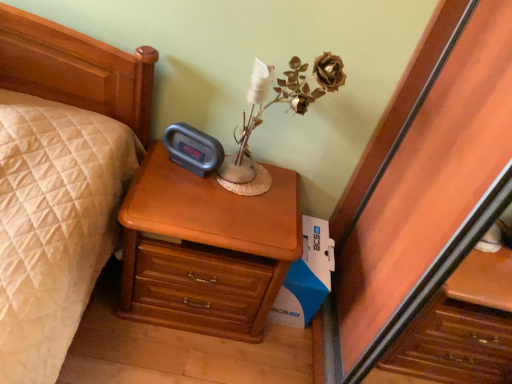
Describe the element at coordinates (206, 250) in the screenshot. This screenshot has width=512, height=384. I see `light brown wood nightstand at center` at that location.

This screenshot has height=384, width=512. What do you see at coordinates (329, 72) in the screenshot?
I see `brown dried flower at upper right` at bounding box center [329, 72].

Identify the location of light brown wood nightstand at center. The height and width of the screenshot is (384, 512). (206, 250).

Could you tell me if light brown wood nightstand at center is turned towards brown dried flower at upper right?

No, light brown wood nightstand at center is not turned towards brown dried flower at upper right.

Which object is thinner, light brown wood nightstand at center or brown dried flower at upper right?

brown dried flower at upper right.

Considering the sizes of objects light brown wood nightstand at center and brown dried flower at upper right in the image provided, who is taller, light brown wood nightstand at center or brown dried flower at upper right?

Standing taller between the two is light brown wood nightstand at center.

In the scene shown: Is light brown wood nightstand at center positioned before brown dried flower at upper right?

That is True.

Relative to light brown wood nightstand at center, is white cardboard box at lower right in front or behind?

In the image, white cardboard box at lower right appears behind light brown wood nightstand at center.

Is white cardboard box at lower right not close to light brown wood nightstand at center?

They are positioned close to each other.

Considering the relative positions of white cardboard box at lower right and light brown wood nightstand at center in the image provided, is white cardboard box at lower right to the left of light brown wood nightstand at center from the viewer's perspective?

No, white cardboard box at lower right is not to the left of light brown wood nightstand at center.

The height and width of the screenshot is (384, 512). In the image, there is a white cardboard box at lower right. What are the coordinates of `nightstand above it (from the image's perspective)` in the screenshot? It's located at (206, 250).

The width and height of the screenshot is (512, 384). Find the location of `flower to the right of light brown wood nightstand at center`. flower to the right of light brown wood nightstand at center is located at coordinates (329, 72).

Is brown dried flower at upper right outside of light brown wood nightstand at center?

brown dried flower at upper right is positioned outside light brown wood nightstand at center.

What's the angular difference between brown dried flower at upper right and light brown wood nightstand at center's facing directions?

The angular difference between brown dried flower at upper right and light brown wood nightstand at center is 0.431 degrees.

Is brown dried flower at upper right with light brown wood nightstand at center?

They are not placed beside each other.

Do you think brown dried flower at upper right is within white cardboard box at lower right, or outside of it?

brown dried flower at upper right is not inside white cardboard box at lower right, it's outside.

Considering the sizes of brown dried flower at upper right and white cardboard box at lower right in the image, is brown dried flower at upper right wider or thinner than white cardboard box at lower right?

Considering their sizes, brown dried flower at upper right looks slimmer than white cardboard box at lower right.

From a real-world perspective, is brown dried flower at upper right located higher than white cardboard box at lower right?

Indeed, from a real-world perspective, brown dried flower at upper right stands above white cardboard box at lower right.

Which is more to the left, white cardboard box at lower right or brown dried flower at upper right?

From the viewer's perspective, white cardboard box at lower right appears more on the left side.

What's the angular difference between white cardboard box at lower right and brown dried flower at upper right's facing directions?

The facing directions of white cardboard box at lower right and brown dried flower at upper right are 0.43 degrees apart.

Looking at this image, is brown dried flower at upper right surrounded by white cardboard box at lower right?

Definitely not — brown dried flower at upper right is not inside white cardboard box at lower right.

Considering the relative positions of white cardboard box at lower right and brown dried flower at upper right in the image provided, is white cardboard box at lower right in front of brown dried flower at upper right?

No, white cardboard box at lower right is further to the viewer.

From a real-world perspective, who is located higher, light brown wood nightstand at center or white cardboard box at lower right?

light brown wood nightstand at center is physically above.

Is light brown wood nightstand at center positioned far away from white cardboard box at lower right?

light brown wood nightstand at center is near white cardboard box at lower right, not far away.

In the scene shown: Who is taller, light brown wood nightstand at center or white cardboard box at lower right?

With more height is light brown wood nightstand at center.

Does light brown wood nightstand at center have a larger size compared to white cardboard box at lower right?

Correct, light brown wood nightstand at center is larger in size than white cardboard box at lower right.

This screenshot has width=512, height=384. Find the location of `nightstand on the left of the brown dried flower at upper right`. nightstand on the left of the brown dried flower at upper right is located at coordinates (206, 250).

The height and width of the screenshot is (384, 512). In order to click on nightstand located in front of the white cardboard box at lower right in this screenshot , I will do `click(206, 250)`.

Which object lies nearer to the anchor point white cardboard box at lower right, brown dried flower at upper right or light brown wood nightstand at center?

light brown wood nightstand at center is positioned closer to the anchor white cardboard box at lower right.

In the scene shown: Which object lies nearer to the anchor point white cardboard box at lower right, light brown wood nightstand at center or brown dried flower at upper right?

The object closer to white cardboard box at lower right is light brown wood nightstand at center.

Looking at this image, considering their positions, is white cardboard box at lower right positioned further to brown dried flower at upper right than light brown wood nightstand at center?

white cardboard box at lower right is positioned further to the anchor brown dried flower at upper right.

Estimate the real-world distances between objects in this image. Which object is closer to light brown wood nightstand at center, brown dried flower at upper right or white cardboard box at lower right?

The object closer to light brown wood nightstand at center is white cardboard box at lower right.

Which object lies further to the anchor point light brown wood nightstand at center, white cardboard box at lower right or brown dried flower at upper right?

brown dried flower at upper right.

When comparing their distances from brown dried flower at upper right, does light brown wood nightstand at center or white cardboard box at lower right seem further?

Based on the image, white cardboard box at lower right appears to be further to brown dried flower at upper right.

Image resolution: width=512 pixels, height=384 pixels. I want to click on nightstand that lies between brown dried flower at upper right and white cardboard box at lower right from top to bottom, so click(x=206, y=250).